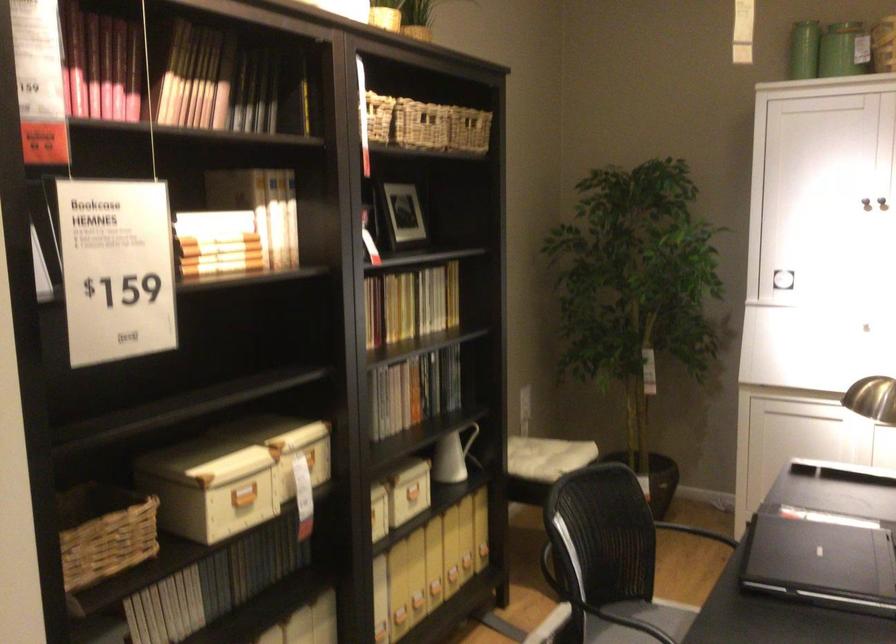
In order to click on chair sitting surface in this screenshot , I will do `click(661, 619)`.